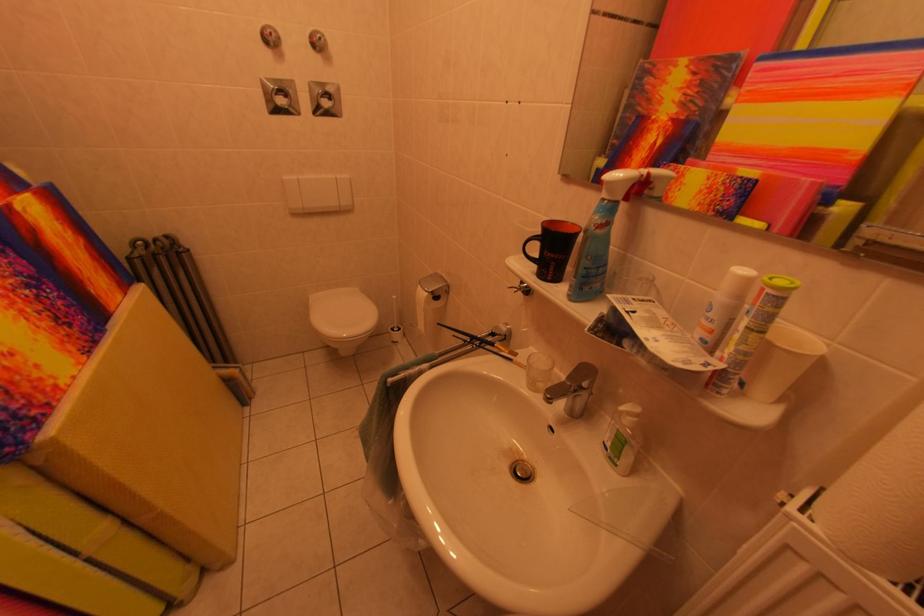
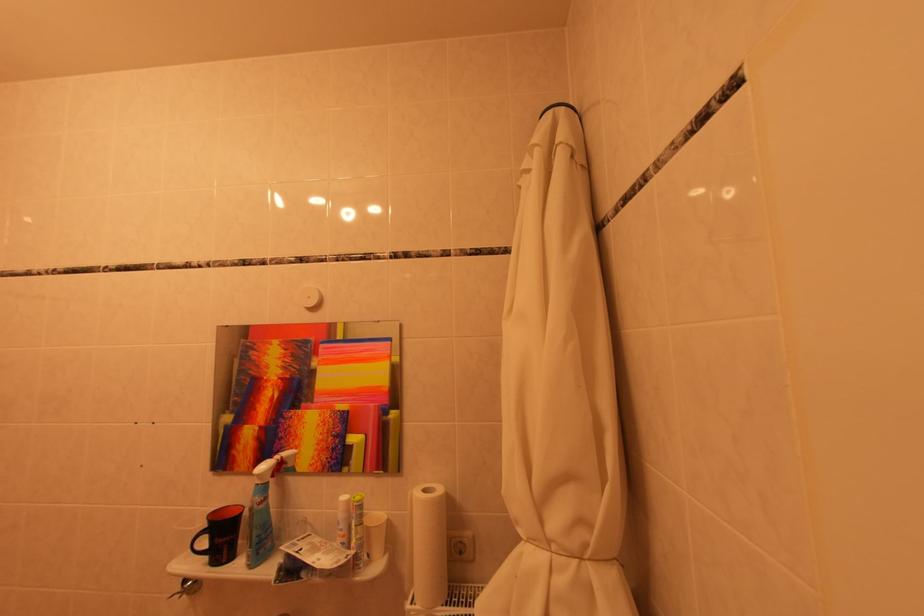
Locate, in the second image, the point that corresponds to pixel 747 355 in the first image.

(365, 544)